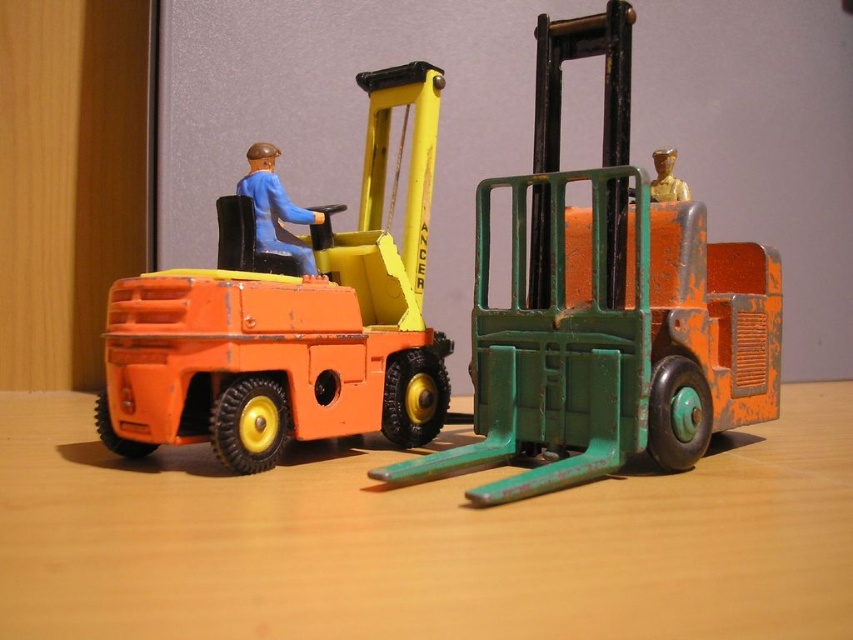
You are setting up a display for a toy store and have two forklifts. The green matte forklift at right and the orange matte forklift at left. Which forklift should you choose if you need a larger one for the main showcase?

The green matte forklift at right is bigger than the orange matte forklift at left, so you should choose the green matte forklift at right for the main showcase.

You are organizing a toy display and need to place both the green matte forklift at right and the gold metallic figure at center on a shelf. The shelf has a height limit of 10 cm. Can you determine if both items will fit without exceeding the height limit?

The green matte forklift at right has a greater height compared to the gold metallic figure at center. However, since the height limit is 10 cm and the exact heights are not provided, it is impossible to determine if both items will fit without exceeding the height limit.